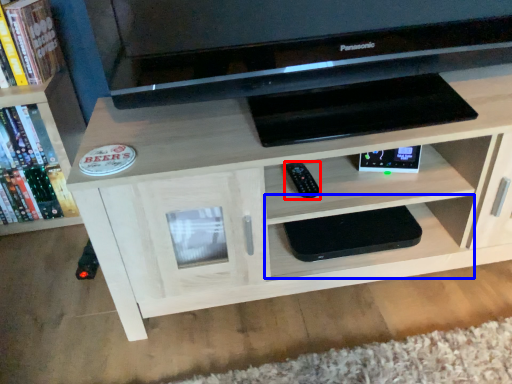
Question: Which point is closer to the camera, remote (highlighted by a red box) or shelf (highlighted by a blue box)?

Choices:
 (A) remote
 (B) shelf

Answer: (A)